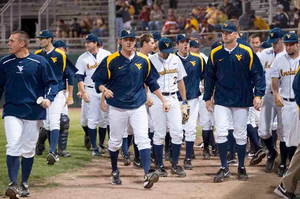
At what (x,y) coordinates should I click in order to perform the action: click on entry way. Please return your answer as a coordinate pair (x, y). Image resolution: width=300 pixels, height=199 pixels. Looking at the image, I should click on (23, 30).